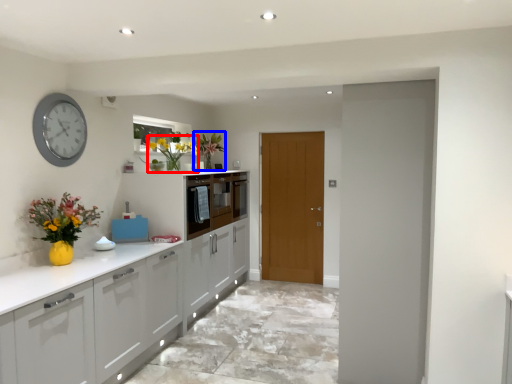
Question: Which object is further to the camera taking this photo, floral arrangement (highlighted by a red box) or floral arrangement (highlighted by a blue box)?

Choices:
 (A) floral arrangement
 (B) floral arrangement

Answer: (B)